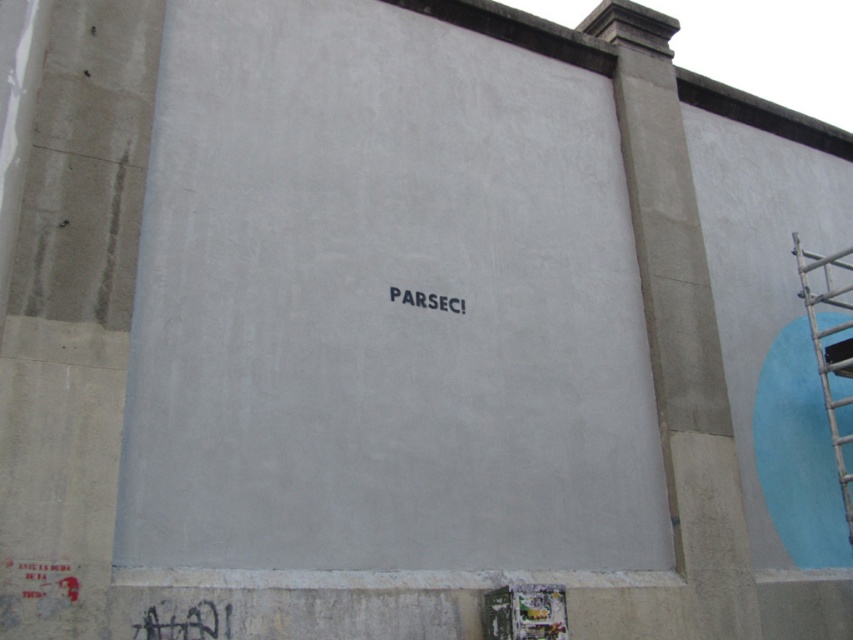
Who is positioned more to the right, wooden scaffolding at right or black graffiti at lower left?

From the viewer's perspective, wooden scaffolding at right appears more on the right side.

Which is behind, point (843, 474) or point (201, 612)?

The point (843, 474) is behind.

Locate an element on the screen. The height and width of the screenshot is (640, 853). wooden scaffolding at right is located at coordinates (822, 349).

Does black graffiti at lower left appear on the right side of black matte text at center?

No, black graffiti at lower left is not to the right of black matte text at center.

In the scene shown: Is black graffiti at lower left smaller than black matte text at center?

Actually, black graffiti at lower left might be larger than black matte text at center.

Does point (186, 611) come farther from viewer compared to point (421, 292)?

No, (186, 611) is closer to viewer.

Where is `black graffiti at lower left`? The height and width of the screenshot is (640, 853). black graffiti at lower left is located at coordinates (184, 621).

Between wooden scaffolding at right and black matte text at center, which one is positioned higher?

black matte text at center is above.

What do you see at coordinates (822, 349) in the screenshot? I see `wooden scaffolding at right` at bounding box center [822, 349].

You are a GUI agent. You are given a task and a screenshot of the screen. Output one action in this format:
    pyautogui.click(x=<x>, y=<y>)
    Task: Click on the wooden scaffolding at right
    
    Given the screenshot: What is the action you would take?
    pyautogui.click(x=822, y=349)